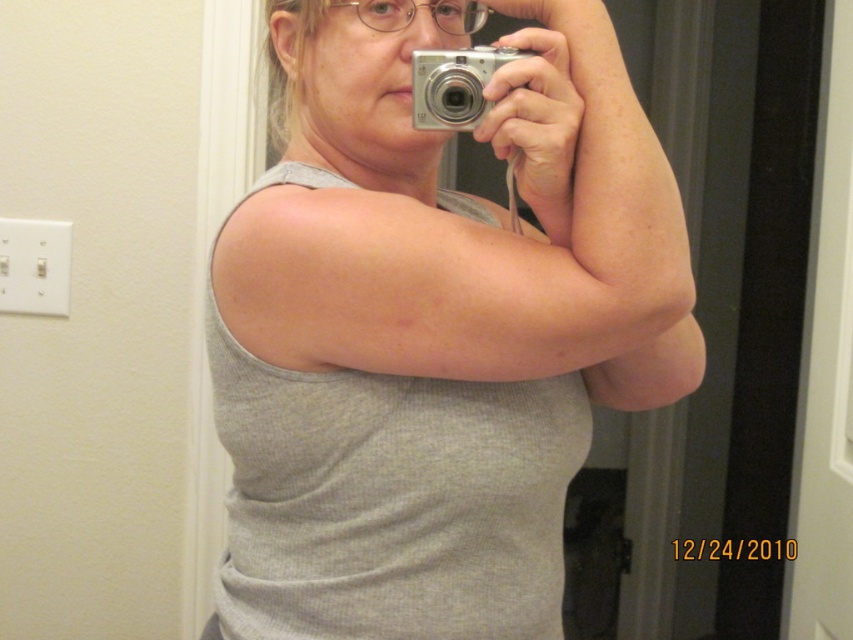
Consider the image. What is the exact location of the gray ribbed tank top at center in the image?

The gray ribbed tank top at center is located at point coordinates of [436,330].

You are a photographer trying to adjust your camera settings. You notice the gray ribbed tank top at center and the silver metallic camera at center. Which object is closer to you according to the scene?

Answer: The gray ribbed tank top at center is in front of the silver metallic camera at center, so it is closer to you.

You are a photographer trying to capture a mirror selfie. You have a gray ribbed tank top at center and a silver metallic camera at center. Which object is larger in the photo?

The gray ribbed tank top at center is bigger than the silver metallic camera at center in the photo.